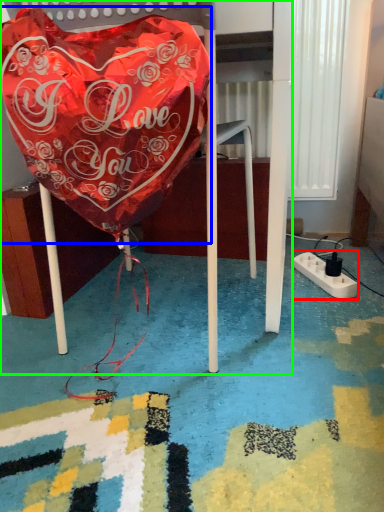
Question: Which is farther away from extension cord (highlighted by a red box)? blanket (highlighted by a blue box) or furniture (highlighted by a green box)?

Choices:
 (A) blanket
 (B) furniture

Answer: (A)